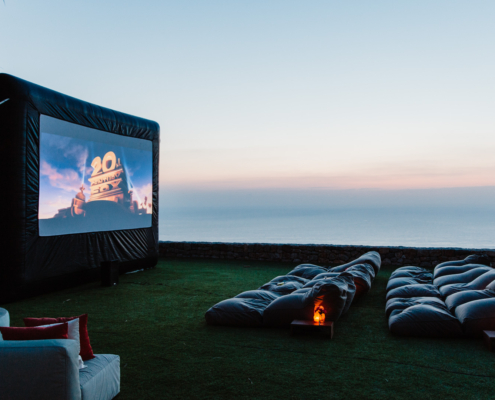
The width and height of the screenshot is (495, 400). I want to click on seating, so click(253, 308), click(286, 282), click(306, 272), click(422, 310), click(470, 279), click(444, 266), click(54, 360).